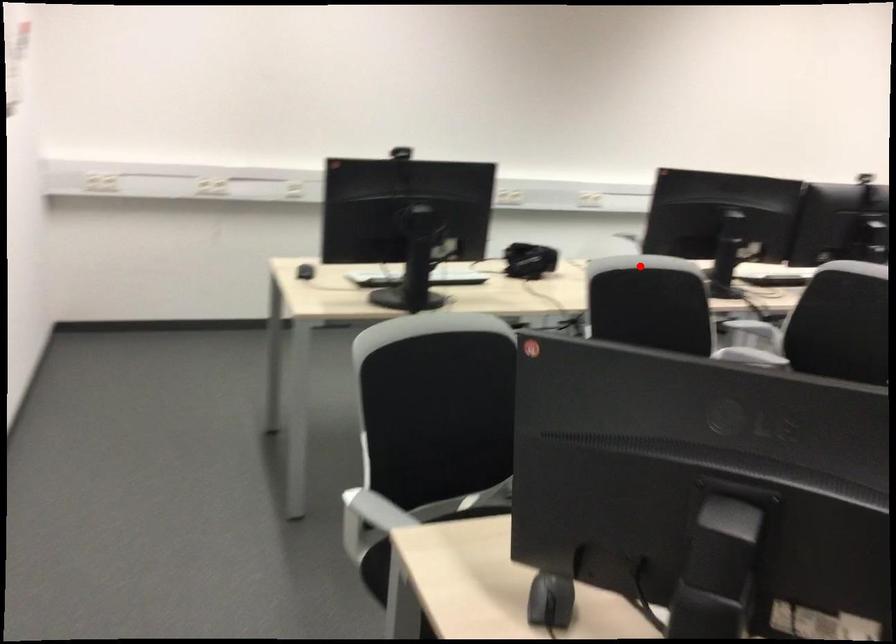
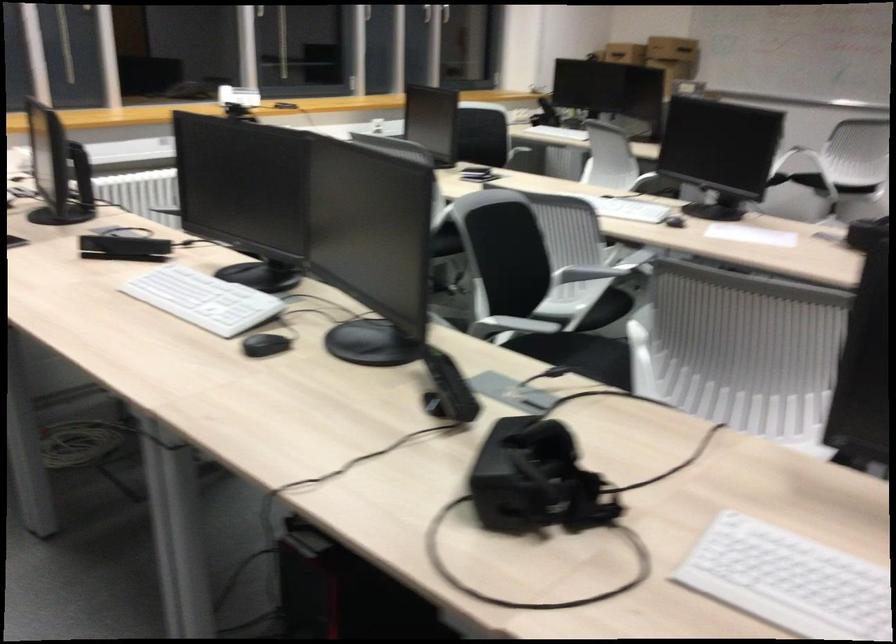
Locate, in the second image, the point that corresponds to the highlighted location in the first image.

(734, 277)